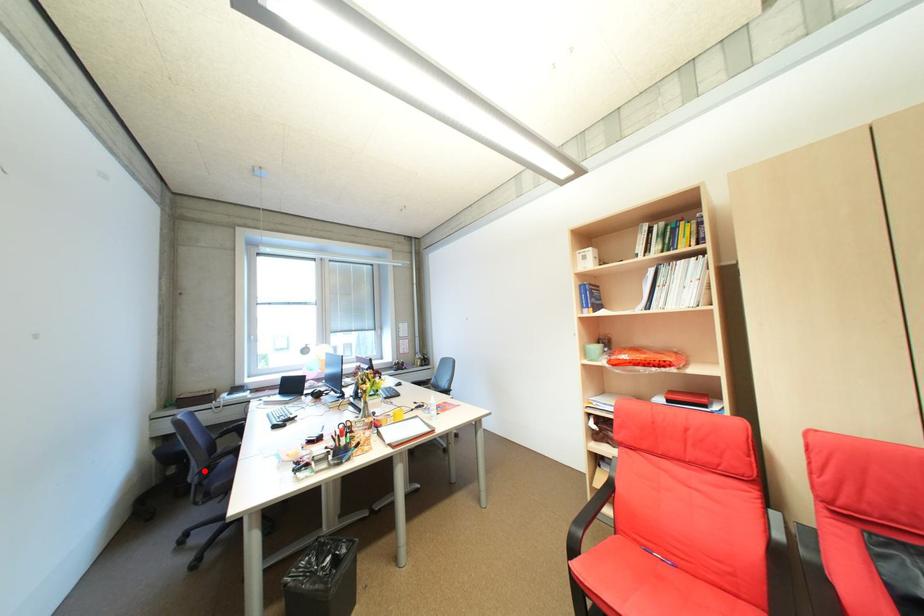
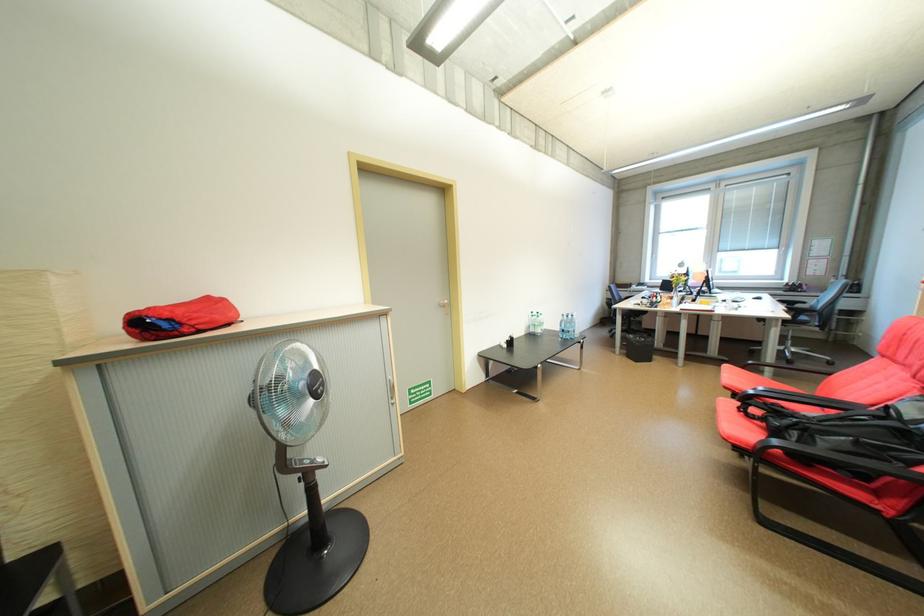
Question: I am providing you with two images of the same scene from different viewpoints. A red point is marked on the first image. Is the red point's position out of view in image 2?

Choices:
 (A) Yes
 (B) No

Answer: (A)